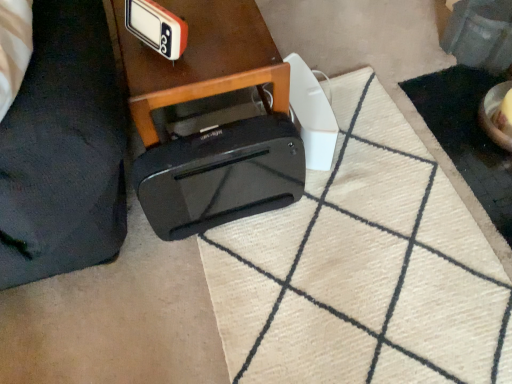
Question: Is black glossy printer at center shorter than orange plastic clock at upper center?

Choices:
 (A) yes
 (B) no

Answer: (B)

Question: From a real-world perspective, is black glossy printer at center physically above orange plastic clock at upper center?

Choices:
 (A) no
 (B) yes

Answer: (A)

Question: Can you confirm if black glossy printer at center is taller than orange plastic clock at upper center?

Choices:
 (A) yes
 (B) no

Answer: (A)

Question: Could you tell me if black glossy printer at center is facing orange plastic clock at upper center?

Choices:
 (A) yes
 (B) no

Answer: (B)

Question: Is black glossy printer at center at the right side of orange plastic clock at upper center?

Choices:
 (A) yes
 (B) no

Answer: (A)

Question: Is black glossy printer at center bigger or smaller than black plastic bag at lower left?

Choices:
 (A) small
 (B) big

Answer: (A)

Question: From a real-world perspective, relative to black plastic bag at lower left, is black glossy printer at center vertically above or below?

Choices:
 (A) below
 (B) above

Answer: (A)

Question: In the image, is black glossy printer at center on the left side or the right side of black plastic bag at lower left?

Choices:
 (A) left
 (B) right

Answer: (B)

Question: Choose the correct answer: Is black glossy printer at center inside black plastic bag at lower left or outside it?

Choices:
 (A) outside
 (B) inside

Answer: (A)

Question: Would you say black glossy printer at center is inside or outside black plastic toaster at lower center?

Choices:
 (A) inside
 (B) outside

Answer: (B)

Question: Considering the positions of black glossy printer at center and black plastic toaster at lower center in the image, is black glossy printer at center wider or thinner than black plastic toaster at lower center?

Choices:
 (A) wide
 (B) thin

Answer: (A)

Question: Visually, is black glossy printer at center positioned to the left or to the right of black plastic toaster at lower center?

Choices:
 (A) right
 (B) left

Answer: (B)

Question: From a real-world perspective, is black glossy printer at center positioned above or below black plastic toaster at lower center?

Choices:
 (A) above
 (B) below

Answer: (A)

Question: Considering their positions, is white textured doormat at lower center located in front of or behind black glossy printer at center?

Choices:
 (A) front
 (B) behind

Answer: (B)

Question: In terms of size, does white textured doormat at lower center appear bigger or smaller than black glossy printer at center?

Choices:
 (A) small
 (B) big

Answer: (A)